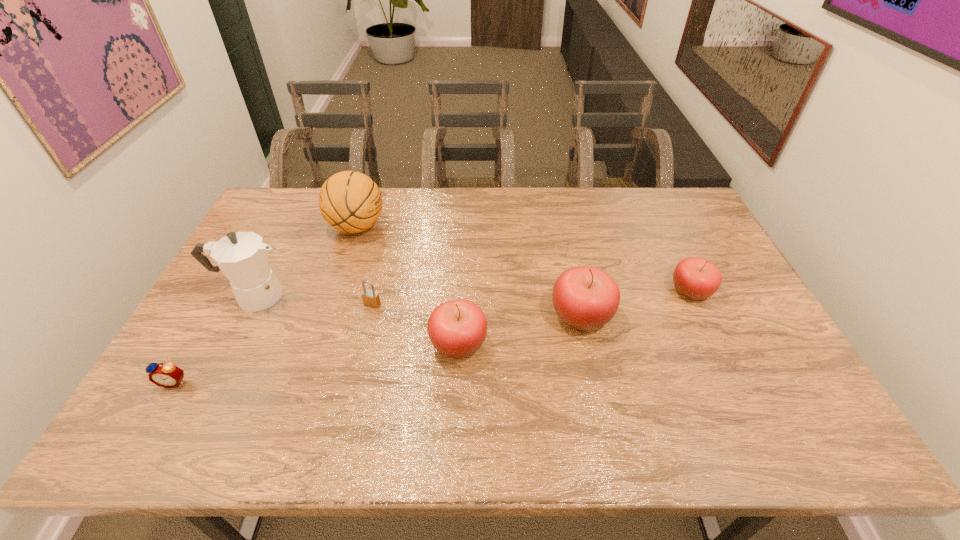
I want to click on free space that satisfies the following two spatial constraints: 1. on the back side of the padlock; 2. at the spout of the coffeepot, so (374, 296).

Image resolution: width=960 pixels, height=540 pixels. Find the location of `vacant point that satisfies the following two spatial constraints: 1. at the spout of the coffeepot; 2. on the back side of the padlock`. vacant point that satisfies the following two spatial constraints: 1. at the spout of the coffeepot; 2. on the back side of the padlock is located at coordinates (250, 304).

Image resolution: width=960 pixels, height=540 pixels. Find the location of `free location that satisfies the following two spatial constraints: 1. at the spout of the second apple from left to right; 2. on the left side of the coffeepot`. free location that satisfies the following two spatial constraints: 1. at the spout of the second apple from left to right; 2. on the left side of the coffeepot is located at coordinates (244, 316).